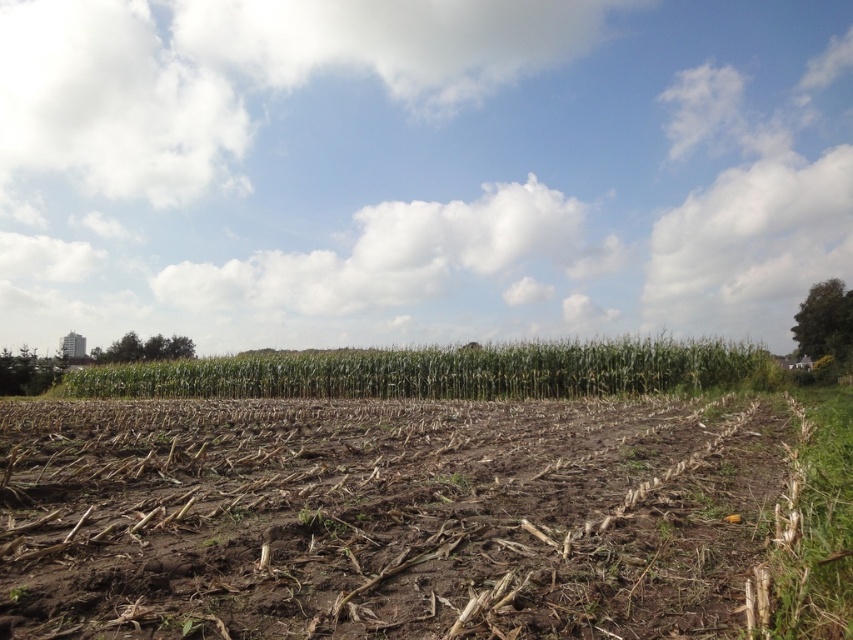
Where is `brown dirt at center`? brown dirt at center is located at coordinates (383, 516).

The image size is (853, 640). Identify the location of brown dirt at center. (383, 516).